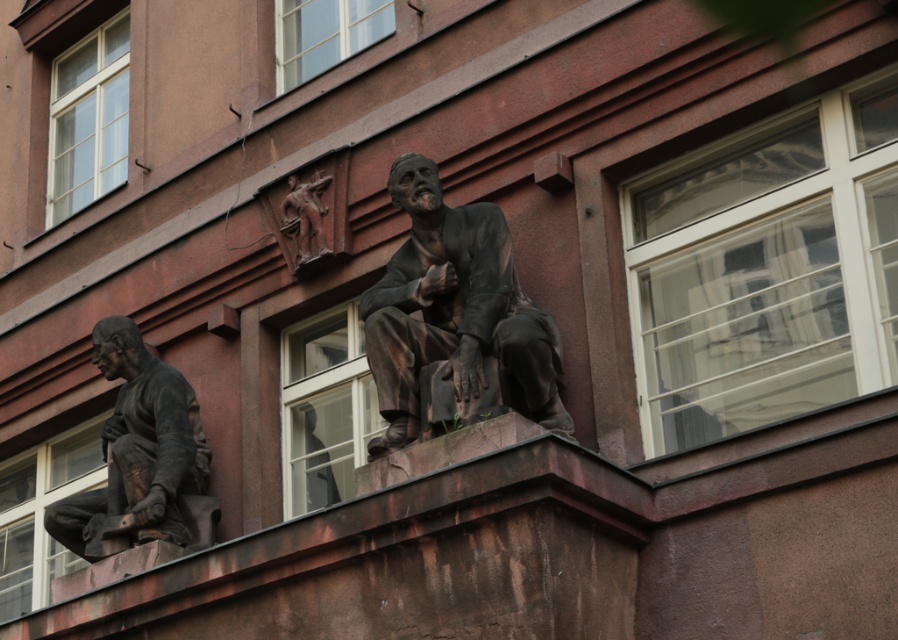
You are a window cleaner working on the building facade. You need to clean the windows near the bronze statue at upper center and the matte bronze statue at lower left. Which statue requires you to climb higher to reach its corresponding window?

The bronze statue at upper center is positioned over the matte bronze statue at lower left, so you will need to climb higher to reach the windows near the bronze statue at upper center.

You are standing in front of the building and see the bronze statue at upper center marked by point (455, 310). Where would you look to find the statue?

The bronze statue at upper center is located at the coordinates marked by point (455, 310).

You are standing in front of the building and want to take a photo. You notice two points on the facade at coordinates point (411, 432) and point (156, 509). Which point will appear larger in your photo?

Point (411, 432) is closer to the camera than point (156, 509), so it will appear larger in the photo.